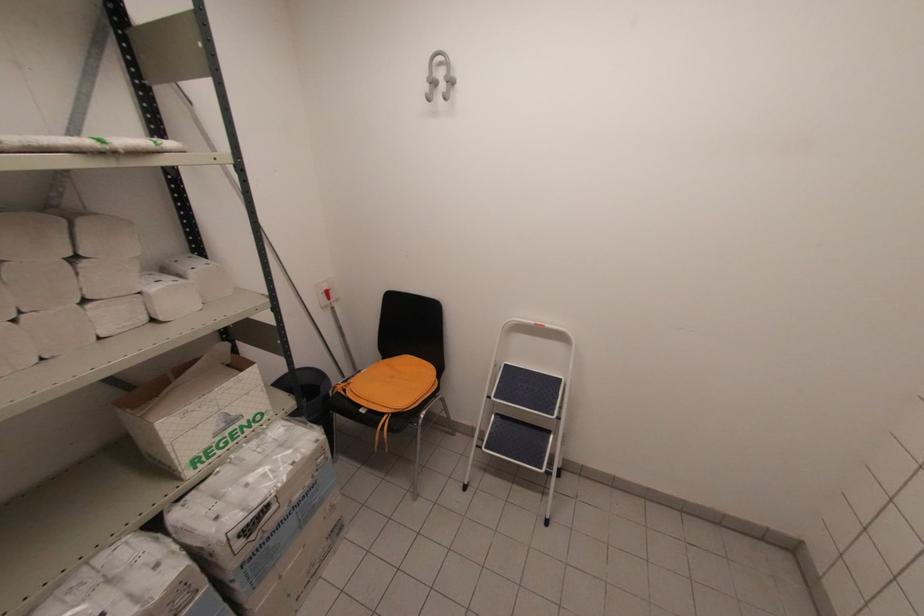
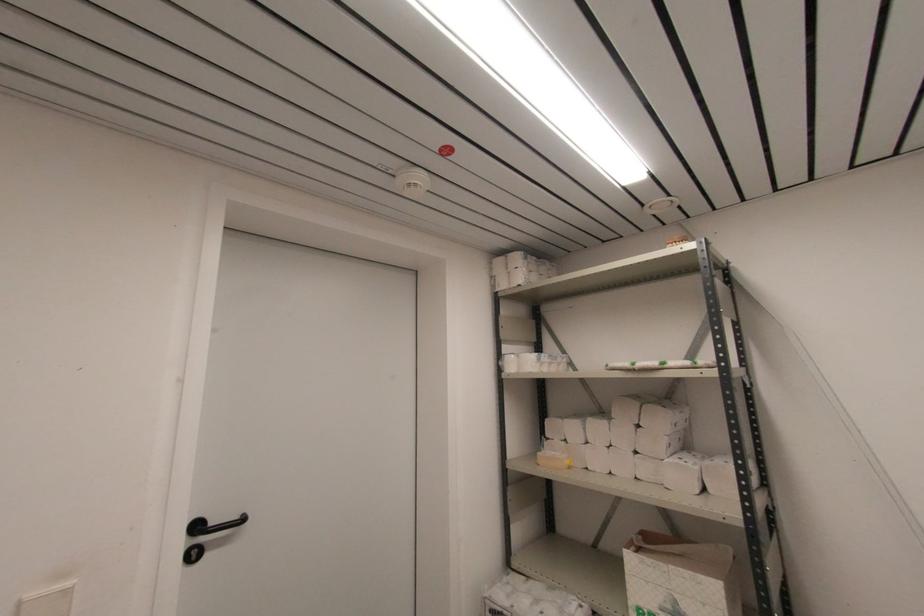
In the second image, find the point that corresponds to the point at 224,426 in the first image.

(671, 609)